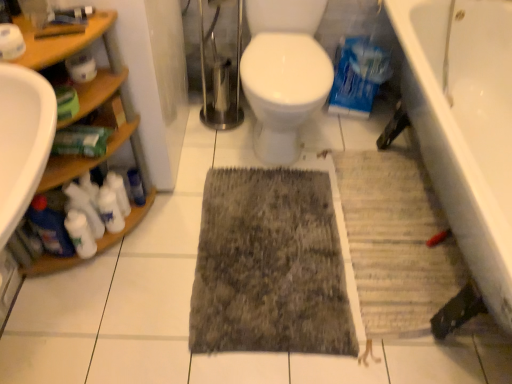
Identify the location of spots to the right of white matte cleaning products at lower left, which is the second cleaning product in right-to-left order. The height and width of the screenshot is (384, 512). (161, 241).